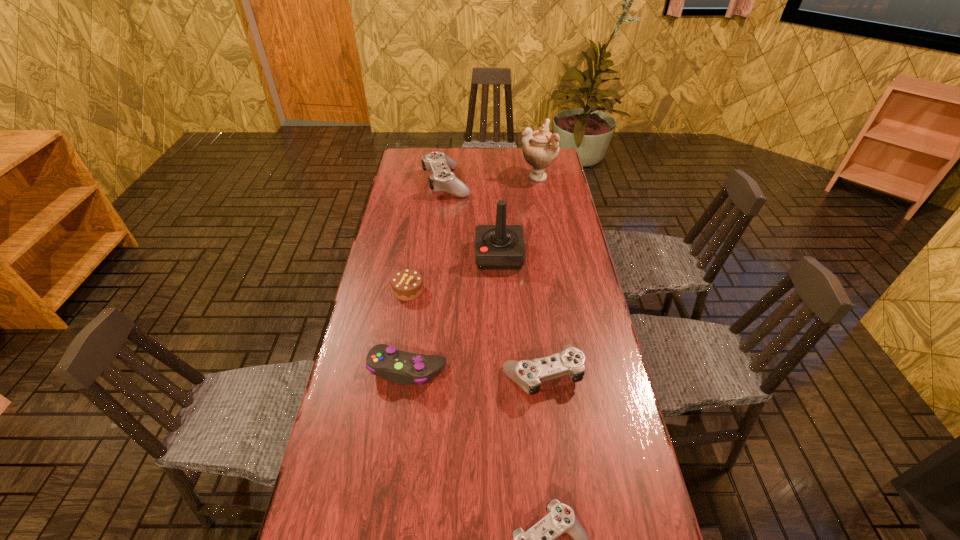
This screenshot has height=540, width=960. Find the location of `urn present at the right edge`. urn present at the right edge is located at coordinates (540, 148).

Identify the location of control present at the right edge. Image resolution: width=960 pixels, height=540 pixels. (528, 374).

The image size is (960, 540). Identify the location of object that is at the far left corner. (442, 178).

At what (x,y) coordinates should I click in order to perform the action: click on object at the far right corner. Please return your answer as a coordinate pair (x, y). The width and height of the screenshot is (960, 540). Looking at the image, I should click on (540, 148).

Locate an element on the screen. The height and width of the screenshot is (540, 960). vacant area at the far edge is located at coordinates (493, 149).

In the image, there is a desktop. Where is `vacant space at the left edge`? Image resolution: width=960 pixels, height=540 pixels. vacant space at the left edge is located at coordinates (x=360, y=355).

Where is `free point at the right edge`? free point at the right edge is located at coordinates (636, 453).

Image resolution: width=960 pixels, height=540 pixels. Find the location of `vacant space at the far right corner of the desktop`. vacant space at the far right corner of the desktop is located at coordinates (554, 168).

The width and height of the screenshot is (960, 540). I want to click on free space between the farthest control and the joystick, so click(472, 219).

Where is `free space between the chocolate cake and the second biggest white control`? The image size is (960, 540). free space between the chocolate cake and the second biggest white control is located at coordinates (475, 332).